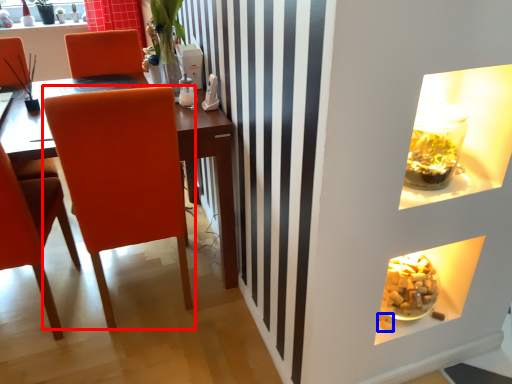
Question: Which object is closer to the camera taking this photo, chair (highlighted by a red box) or food (highlighted by a blue box)?

Choices:
 (A) chair
 (B) food

Answer: (A)